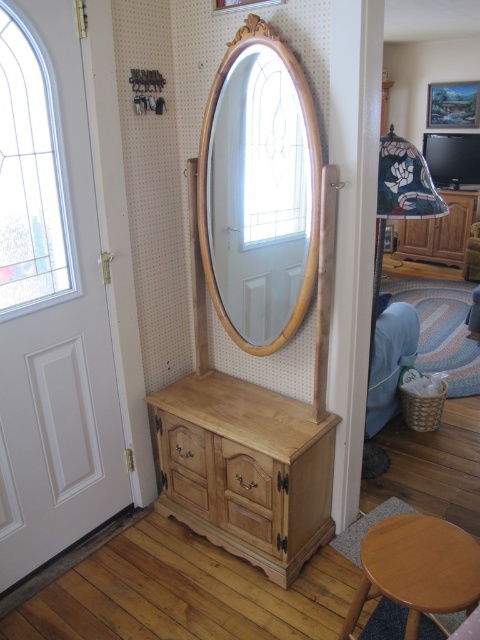
You are trying to decide whether to place a new painting on the wall between the wooden mirror at center and the light brown wooden stool at lower right. Based on their heights, which object should the painting be placed closer to in order to maintain visual balance?

The wooden mirror at center is taller than the light brown wooden stool at lower right, so to maintain visual balance, the painting should be placed closer to the light brown wooden stool at lower right.

You are moving a painting that is 1.2 meters tall. You want to hang it on the wall above the natural wood dresser at center and the wooden drawer at center. Which object should you choose to place the painting above so that it fits vertically?

The natural wood dresser at center is taller than the wooden drawer at center, so the painting should be placed above the natural wood dresser at center since it can accommodate the painting vertically.